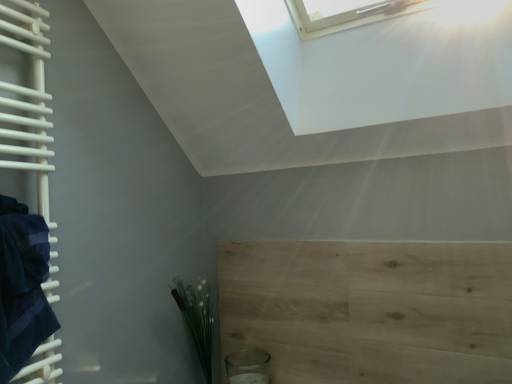
In order to face dark blue towel at left, should I rotate leftwards or rightwards?

Turn left approximately 28.478 degrees to face it.

In order to click on green matte plant at lower left in this screenshot , I will do `click(197, 317)`.

Considering the relative positions of light wood plywood at lower right and dark blue towel at left in the image provided, is light wood plywood at lower right to the left or to the right of dark blue towel at left?

Clearly, light wood plywood at lower right is on the right of dark blue towel at left in the image.

Is light wood plywood at lower right oriented towards dark blue towel at left?

Yes, light wood plywood at lower right is turned towards dark blue towel at left.

Is light wood plywood at lower right taller or shorter than dark blue towel at left?

Clearly, light wood plywood at lower right is taller compared to dark blue towel at left.

Locate an element on the screen. The width and height of the screenshot is (512, 384). plywood beneath the dark blue towel at left (from a real-world perspective) is located at coordinates (370, 310).

Considering the points (16, 223) and (307, 278), which point is behind, point (16, 223) or point (307, 278)?

The point (307, 278) is farther from the camera.

Does dark blue towel at left come in front of light wood plywood at lower right?

Yes, dark blue towel at left is in front of light wood plywood at lower right.

Would you say dark blue towel at left is outside light wood plywood at lower right?

Yes, dark blue towel at left is outside of light wood plywood at lower right.

Is dark blue towel at left wider or thinner than green matte plant at lower left?

Considering their sizes, dark blue towel at left looks slimmer than green matte plant at lower left.

Is dark blue towel at left bigger than green matte plant at lower left?

Correct, dark blue towel at left is larger in size than green matte plant at lower left.

Which of these two, dark blue towel at left or green matte plant at lower left, stands taller?

With more height is dark blue towel at left.

Identify the location of blanket in front of the green matte plant at lower left. This screenshot has width=512, height=384. (22, 286).

From a real-world perspective, is light wood plywood at lower right below green matte plant at lower left?

Incorrect, from a real-world perspective, light wood plywood at lower right is higher than green matte plant at lower left.

Is light wood plywood at lower right positioned behind green matte plant at lower left?

That is False.

Between light wood plywood at lower right and green matte plant at lower left, which one appears on the left side from the viewer's perspective?

Positioned to the left is green matte plant at lower left.

Which of these two, green matte plant at lower left or light wood plywood at lower right, is smaller?

light wood plywood at lower right is smaller.

Is green matte plant at lower left thinner than light wood plywood at lower right?

In fact, green matte plant at lower left might be wider than light wood plywood at lower right.

Relative to light wood plywood at lower right, is green matte plant at lower left in front or behind?

green matte plant at lower left is positioned farther from the viewer than light wood plywood at lower right.

From the image's perspective, is green matte plant at lower left above or below light wood plywood at lower right?

green matte plant at lower left is situated lower than light wood plywood at lower right in the image.

Locate an element on the screen. plant behind the dark blue towel at left is located at coordinates (197, 317).

Is green matte plant at lower left oriented towards dark blue towel at left?

Yes, green matte plant at lower left faces towards dark blue towel at left.

Which object is closer to the camera taking this photo, green matte plant at lower left or dark blue towel at left?

Positioned in front is dark blue towel at left.

Can dark blue towel at left be found inside green matte plant at lower left?

No.

This screenshot has height=384, width=512. In order to click on blanket located in front of the light wood plywood at lower right in this screenshot , I will do `click(22, 286)`.

Image resolution: width=512 pixels, height=384 pixels. I want to click on plywood that appears behind the dark blue towel at left, so click(370, 310).

Looking at the image, which one is located closer to dark blue towel at left, light wood plywood at lower right or green matte plant at lower left?

green matte plant at lower left is positioned closer to the anchor dark blue towel at left.

Looking at this image, from the image, which object appears to be farther from green matte plant at lower left, light wood plywood at lower right or dark blue towel at left?

dark blue towel at left lies further to green matte plant at lower left than the other object.

Which object lies further to the anchor point green matte plant at lower left, dark blue towel at left or light wood plywood at lower right?

Among the two, dark blue towel at left is located further to green matte plant at lower left.

Looking at the image, which one is located further to light wood plywood at lower right, dark blue towel at left or green matte plant at lower left?

The object further to light wood plywood at lower right is dark blue towel at left.

From the picture: Based on their spatial positions, is green matte plant at lower left or dark blue towel at left closer to light wood plywood at lower right?

The object closer to light wood plywood at lower right is green matte plant at lower left.

In the scene shown: Based on their spatial positions, is green matte plant at lower left or light wood plywood at lower right closer to dark blue towel at left?

green matte plant at lower left is positioned closer to the anchor dark blue towel at left.

Locate an element on the screen. plant between dark blue towel at left and light wood plywood at lower right in the horizontal direction is located at coordinates (197, 317).